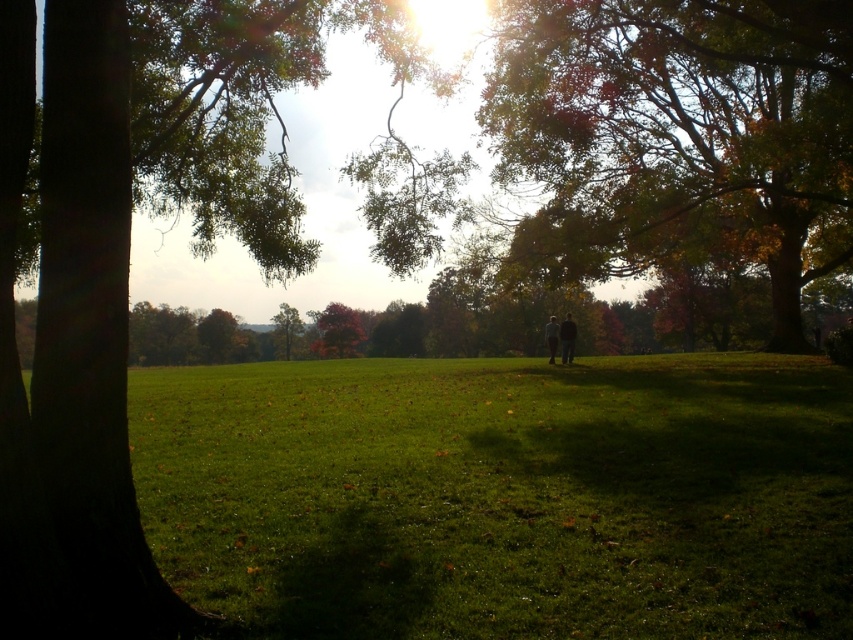
Question: Which object is positioned closest to the green leafy tree at left?

Choices:
 (A) green leafy tree at center
 (B) autumn leaves at center
 (C) light brown leather jacket at center
 (D) dark brown leather jacket at center

Answer: (B)

Question: Does green grass at center appear over reddish-brown bark tree at center?

Choices:
 (A) yes
 (B) no

Answer: (B)

Question: Which object is closer to the camera taking this photo?

Choices:
 (A) reddish-brown bark tree at center
 (B) green leafy tree at center

Answer: (A)

Question: Observing the image, what is the correct spatial positioning of autumn leaves at center in reference to green leafy tree at center?

Choices:
 (A) above
 (B) below

Answer: (A)

Question: Which object is closer to the camera taking this photo?

Choices:
 (A) green grass at center
 (B) reddish-brown bark tree at center
 (C) autumn leaves at center
 (D) light brown leather jacket at center

Answer: (A)

Question: Is green grass at center thinner than autumn leaves at center?

Choices:
 (A) yes
 (B) no

Answer: (B)